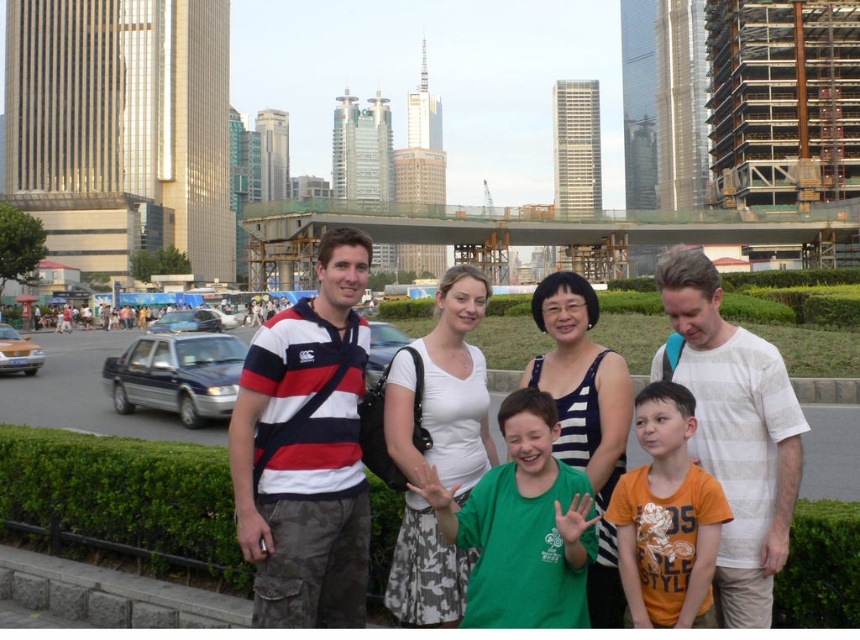
You are a photographer trying to capture a clear shot of the white cotton shirt at center and the metallic blue sedan at left. However, the sedan is blocking part of the shirt. Can you adjust your position to avoid the obstruction?

The white cotton shirt at center is positioned over the metallic blue sedan at left, meaning the shirt is in front of the sedan. To capture a clear shot of both without obstruction, move your camera angle slightly downward to focus on the sedan while keeping the shirt visible above it, or shift your position to the right to ensure the shirt isn not blocking the sedan.